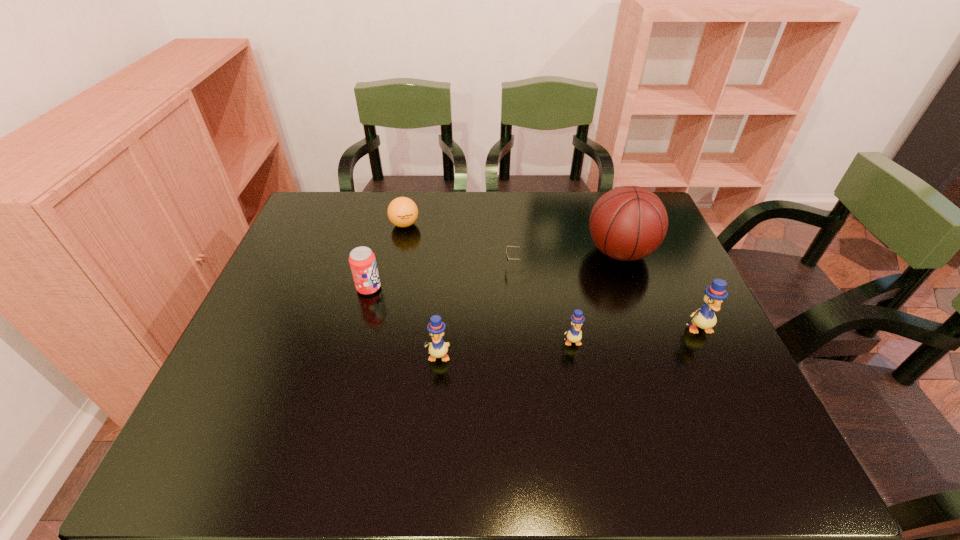
This screenshot has width=960, height=540. Find the location of `the second closest object relative to the second duckling from right to left`. the second closest object relative to the second duckling from right to left is located at coordinates (628, 223).

Choose which object is the fifth nearest neighbor to the ping-pong ball. Please provide its 2D coordinates. Your answer should be formatted as a tuple, i.e. [(x, y)], where the tuple contains the x and y coordinates of a point satisfying the conditions above.

[(574, 335)]

At what (x,y) coordinates should I click in order to perform the action: click on duckling that is the second closest to the rightmost duckling. Please return your answer as a coordinate pair (x, y). The image size is (960, 540). Looking at the image, I should click on (438, 348).

Identify the location of duckling that stands as the second closest to the third object from right to left. This screenshot has height=540, width=960. (438, 348).

Locate an element on the screen. vacant space that satisfies the following two spatial constraints: 1. on the front side of the tallest object; 2. on the surface of the soda can is located at coordinates (633, 288).

Where is `free space in the image that satisfies the following two spatial constraints: 1. on the side with brand of the ping-pong ball; 2. on the surface of the soda can`? Image resolution: width=960 pixels, height=540 pixels. free space in the image that satisfies the following two spatial constraints: 1. on the side with brand of the ping-pong ball; 2. on the surface of the soda can is located at coordinates pyautogui.click(x=392, y=288).

The height and width of the screenshot is (540, 960). What are the coordinates of `vacant space that satisfies the following two spatial constraints: 1. on the side with brand of the ping-pong ball; 2. on the surface of the soda can` in the screenshot? It's located at (392, 288).